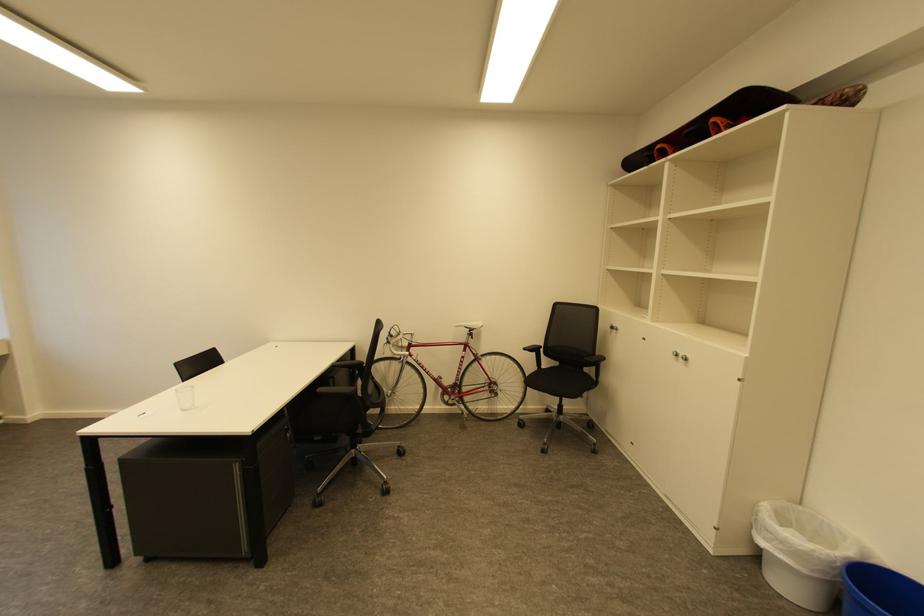
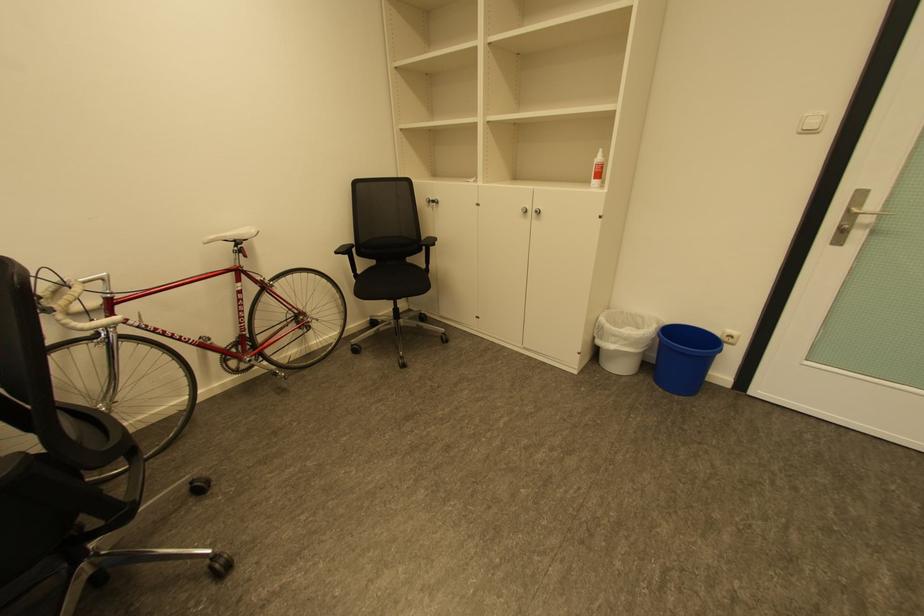
Question: I am providing you with two images of the same scene from different viewpoints. Which of the following objects are not visible in image2?

Choices:
 (A) white bicycle saddle
 (B) blue trash bin
 (C) silver door handle
 (D) none of these

Answer: (D)